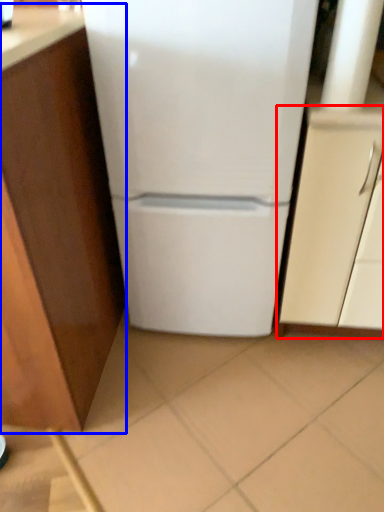
Question: Which point is closer to the camera, cabinetry (highlighted by a red box) or cabinetry (highlighted by a blue box)?

Choices:
 (A) cabinetry
 (B) cabinetry

Answer: (B)